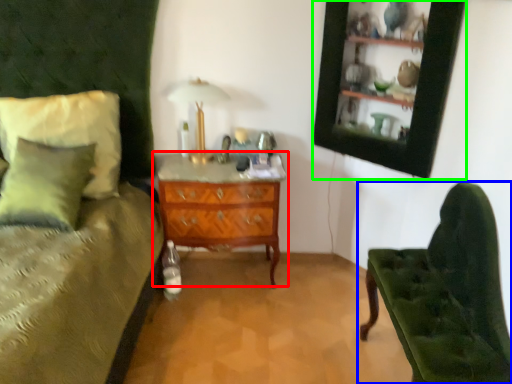
Question: Which object is positioned farthest from chest of drawers (highlighted by a red box)? Select from chair (highlighted by a blue box) and picture frame (highlighted by a green box).

Choices:
 (A) chair
 (B) picture frame

Answer: (A)